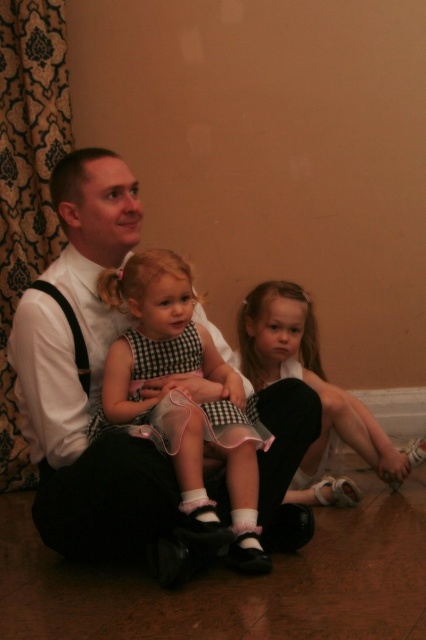
Based on the scene description, where is the white shirt at center located in the image?

The white shirt at center is located at point 0.592 on the x axis and 0.211 on the y axis.